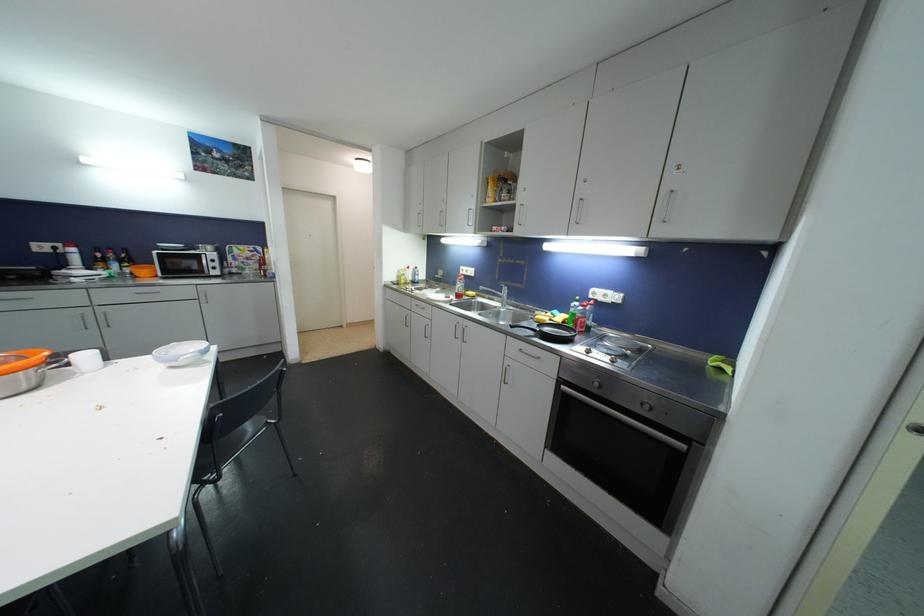
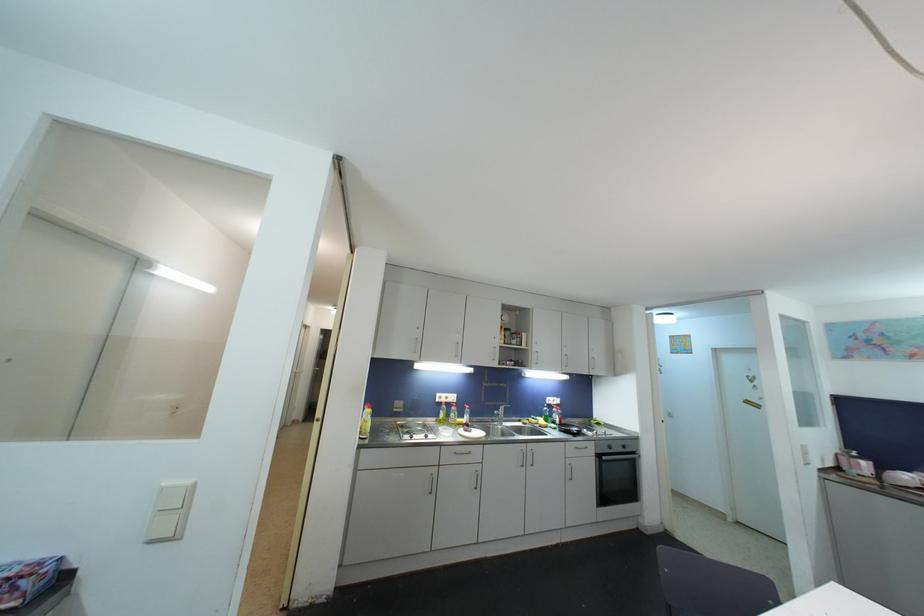
Where in the second image is the point corresponding to (469,274) from the first image?

(450, 400)